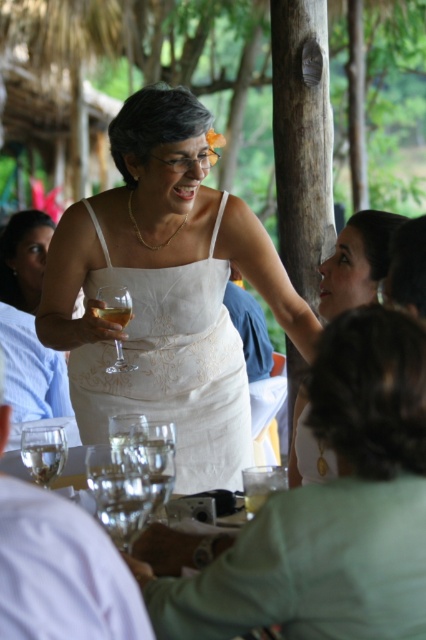
You are standing at the point labeled as point (126, 298) and want to walk towards the woman in the white sleeveless dress. Is the point labeled as point (180, 588) located between you and the woman?

Yes, the point labeled as point (180, 588) is located between you and the woman in the white sleeveless dress because it is in front of point (126, 298), which is your current position.

You are a photographer at the wedding reception. You need to capture a closeup shot of the white satin dress at center and the clear glass wine glass at center. Which object should you zoom in on first to ensure it fits in the frame before adjusting the camera?

The white satin dress at center is larger in size than the clear glass wine glass at center, so you should zoom in on the white satin dress at center first to ensure it fits in the frame before adjusting the camera for the smaller glass.